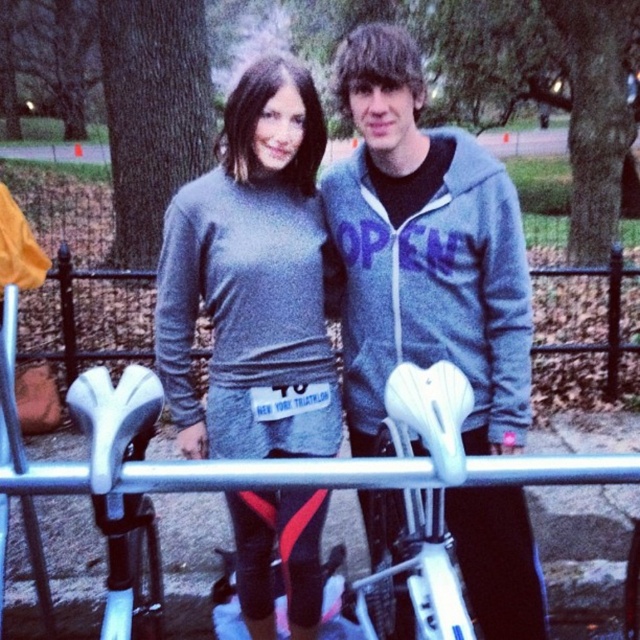
You are at the starting line of the New York Triathlon and see the gray fleece jacket at center. Which direction should you move to reach it?

The gray fleece jacket at center is located at point coordinates, so you should move towards the center of the image to reach it.

You are a participant in the New York Triathlon and need to choose between the gray fleece jacket at center and the gray matte sweater at center for warmth. Based on their sizes, which one would provide more coverage and warmth?

The gray fleece jacket at center is larger in size than the gray matte sweater at center, so it would provide more coverage and warmth.

You are a photographer at a triathlon event. You need to capture a photo of the gray matte sweater at center and white matte bicycle seat at center. Which object is positioned higher in the frame?

The gray matte sweater at center is above the white matte bicycle seat at center, so it is positioned higher in the frame.